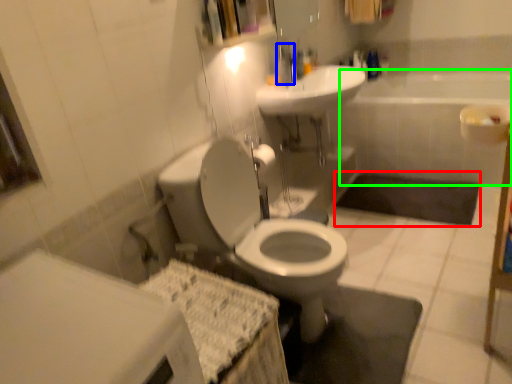
Question: Which object is positioned closest to bath mat (highlighted by a red box)? Select from faucet (highlighted by a blue box) and bath (highlighted by a green box).

Choices:
 (A) faucet
 (B) bath

Answer: (B)